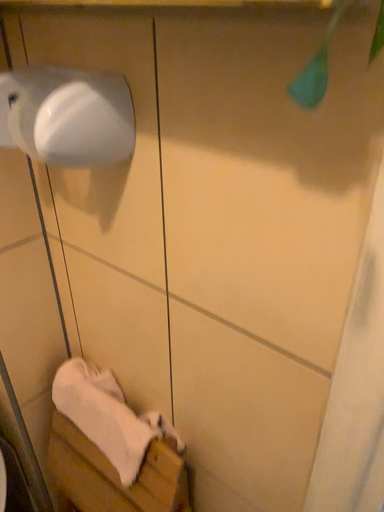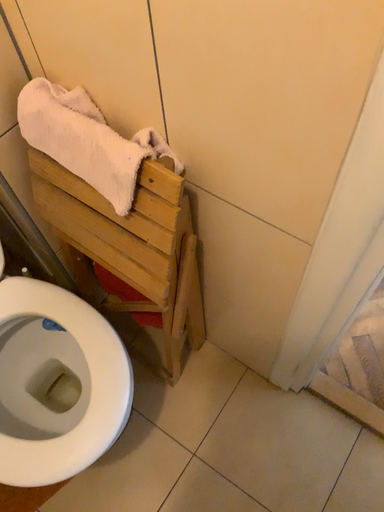
Question: Which way did the camera rotate in the video?

Choices:
 (A) rotated upward
 (B) rotated downward

Answer: (B)